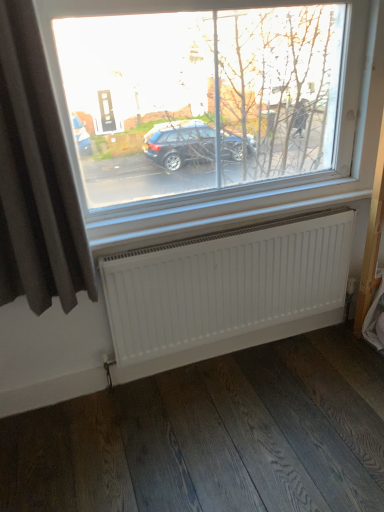
What do you see at coordinates (225, 285) in the screenshot? I see `white matte radiator at lower center` at bounding box center [225, 285].

You are a GUI agent. You are given a task and a screenshot of the screen. Output one action in this format:
    pyautogui.click(x=<x>, y=<y>)
    Task: Click on the white matte radiator at lower center
    
    Given the screenshot: What is the action you would take?
    pyautogui.click(x=225, y=285)

What is the approximate width of white matte radiator at lower center?

3.46 inches.

Image resolution: width=384 pixels, height=512 pixels. What do you see at coordinates (36, 177) in the screenshot? I see `dark grey fabric curtain at left` at bounding box center [36, 177].

The image size is (384, 512). Find the location of `dark grey fabric curtain at left`. dark grey fabric curtain at left is located at coordinates (36, 177).

At what (x,y) coordinates should I click in order to perform the action: click on white matte radiator at lower center. Please return your answer as a coordinate pair (x, y). Looking at the image, I should click on (225, 285).

Between white matte radiator at lower center and dark grey fabric curtain at left, which one appears on the right side from the viewer's perspective?

From the viewer's perspective, white matte radiator at lower center appears more on the right side.

Considering the relative positions of white matte radiator at lower center and dark grey fabric curtain at left in the image provided, is white matte radiator at lower center behind dark grey fabric curtain at left?

That is True.

Is point (321, 213) closer to viewer compared to point (70, 173)?

No, (321, 213) is behind (70, 173).

From the image's perspective, which one is positioned higher, white matte radiator at lower center or dark grey fabric curtain at left?

From the image's view, dark grey fabric curtain at left is above.

In the scene shown: From a real-world perspective, is white matte radiator at lower center located higher than dark grey fabric curtain at left?

Incorrect, from a real-world perspective, white matte radiator at lower center is lower than dark grey fabric curtain at left.

Is white matte radiator at lower center wider than dark grey fabric curtain at left?

No, white matte radiator at lower center is not wider than dark grey fabric curtain at left.

Considering the sizes of white matte radiator at lower center and dark grey fabric curtain at left in the image, is white matte radiator at lower center taller or shorter than dark grey fabric curtain at left?

white matte radiator at lower center is shorter than dark grey fabric curtain at left.

Is white matte radiator at lower center bigger or smaller than dark grey fabric curtain at left?

white matte radiator at lower center is smaller than dark grey fabric curtain at left.

Is dark grey fabric curtain at left inside white matte radiator at lower center?

Definitely not — dark grey fabric curtain at left is not inside white matte radiator at lower center.

Would you say white matte radiator at lower center is a long distance from dark grey fabric curtain at left?

Actually, white matte radiator at lower center and dark grey fabric curtain at left are a little close together.

Is dark grey fabric curtain at left at the back of white matte radiator at lower center?

No, white matte radiator at lower center's orientation is not away from dark grey fabric curtain at left.

Identify the location of radiator that appears below the dark grey fabric curtain at left (from a real-world perspective). This screenshot has width=384, height=512. (225, 285).

Which is more to the left, dark grey fabric curtain at left or white matte radiator at lower center?

dark grey fabric curtain at left.

Between dark grey fabric curtain at left and white matte radiator at lower center, which one is positioned behind?

Positioned behind is white matte radiator at lower center.

Which is less distant, (8, 33) or (303, 248)?

Point (8, 33) is positioned closer to the camera compared to point (303, 248).

From the image's perspective, which is below, dark grey fabric curtain at left or white matte radiator at lower center?

white matte radiator at lower center.

From a real-world perspective, is dark grey fabric curtain at left physically located above or below white matte radiator at lower center?

In terms of real-world spatial position, dark grey fabric curtain at left is above white matte radiator at lower center.

Which of these two, dark grey fabric curtain at left or white matte radiator at lower center, is wider?

Wider between the two is dark grey fabric curtain at left.

Does dark grey fabric curtain at left have a lesser height compared to white matte radiator at lower center?

Incorrect, the height of dark grey fabric curtain at left does not fall short of that of white matte radiator at lower center.

In terms of size, does dark grey fabric curtain at left appear bigger or smaller than white matte radiator at lower center?

dark grey fabric curtain at left is bigger than white matte radiator at lower center.

Does dark grey fabric curtain at left contain white matte radiator at lower center?

Definitely not — white matte radiator at lower center is not inside dark grey fabric curtain at left.

In the scene shown: Are dark grey fabric curtain at left and white matte radiator at lower center beside each other?

dark grey fabric curtain at left and white matte radiator at lower center are not in contact.

Is dark grey fabric curtain at left aimed at white matte radiator at lower center?

No, dark grey fabric curtain at left is not aimed at white matte radiator at lower center.

At what (x,y) coordinates should I click in order to perform the action: click on curtain in front of the white matte radiator at lower center. Please return your answer as a coordinate pair (x, y). This screenshot has width=384, height=512. Looking at the image, I should click on (36, 177).

This screenshot has height=512, width=384. Find the location of `curtain on the left side of white matte radiator at lower center`. curtain on the left side of white matte radiator at lower center is located at coordinates (36, 177).

Locate an element on the screen. Image resolution: width=384 pixels, height=512 pixels. radiator that is under the dark grey fabric curtain at left (from a real-world perspective) is located at coordinates (225, 285).